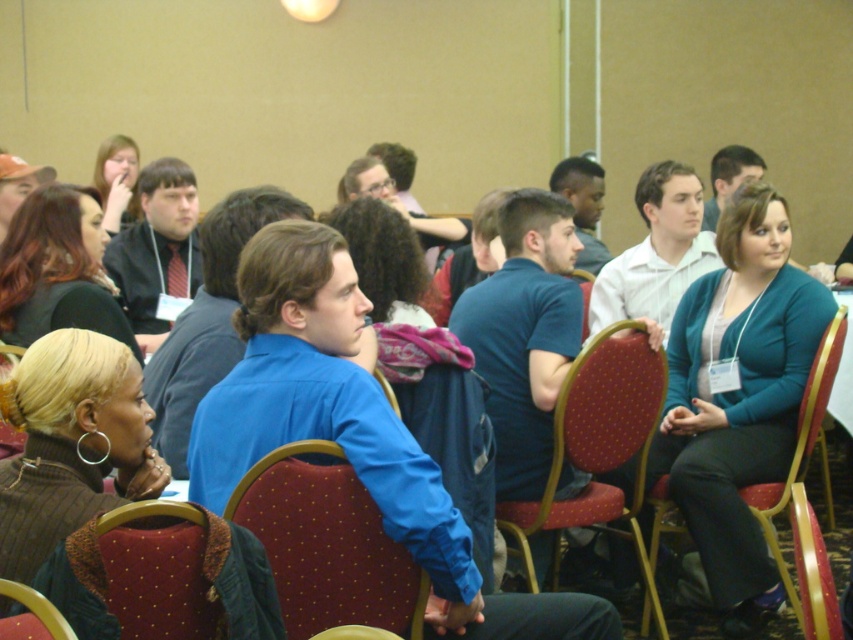
Which is more to the left, maroon fabric chair at center or velvet-like red chair at right?

maroon fabric chair at center

Who is more distant from viewer, (323, 477) or (762, 515)?

The point (762, 515) is behind.

Locate an element on the screen. The width and height of the screenshot is (853, 640). maroon fabric chair at center is located at coordinates (328, 545).

Does matte black jacket at upper left have a greater width compared to velvet red chair at lower left?

Yes, matte black jacket at upper left is wider than velvet red chair at lower left.

The height and width of the screenshot is (640, 853). What are the coordinates of `matte black jacket at upper left` in the screenshot? It's located at (55, 272).

Who is more forward, (53, 244) or (129, 604)?

Point (129, 604)

You are a GUI agent. You are given a task and a screenshot of the screen. Output one action in this format:
    pyautogui.click(x=<x>, y=<y>)
    Task: Click on the matte black jacket at upper left
    The width and height of the screenshot is (853, 640).
    Given the screenshot: What is the action you would take?
    pyautogui.click(x=55, y=272)

Measure the distance between point [547,509] and camera.

They are 10.24 feet apart.

Can you confirm if polka dot fabric chair at center is positioned below velvet red chair at lower left?

Actually, polka dot fabric chair at center is above velvet red chair at lower left.

Is point (589, 483) farther from camera compared to point (202, 570)?

Yes.

Find the location of a particular element. This screenshot has width=853, height=640. polka dot fabric chair at center is located at coordinates (598, 449).